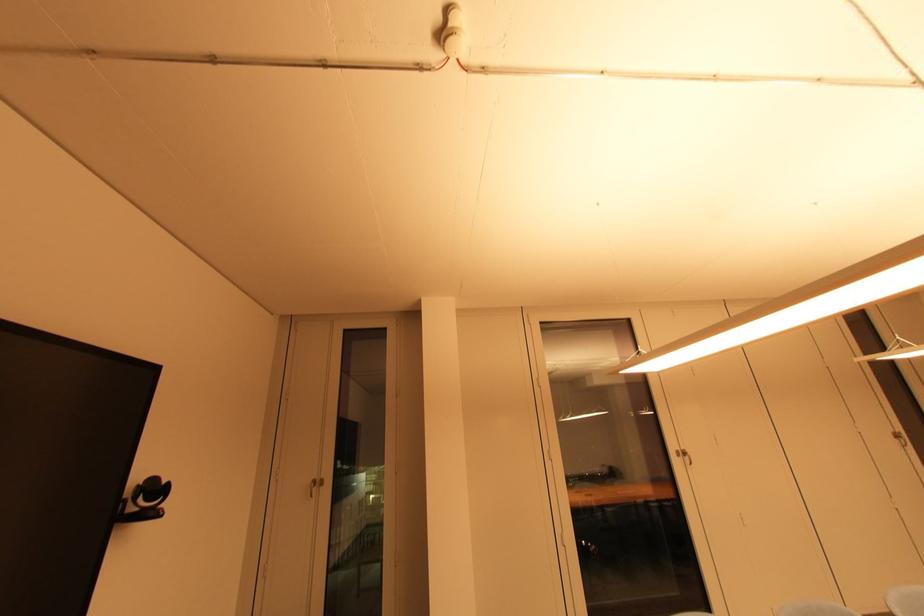
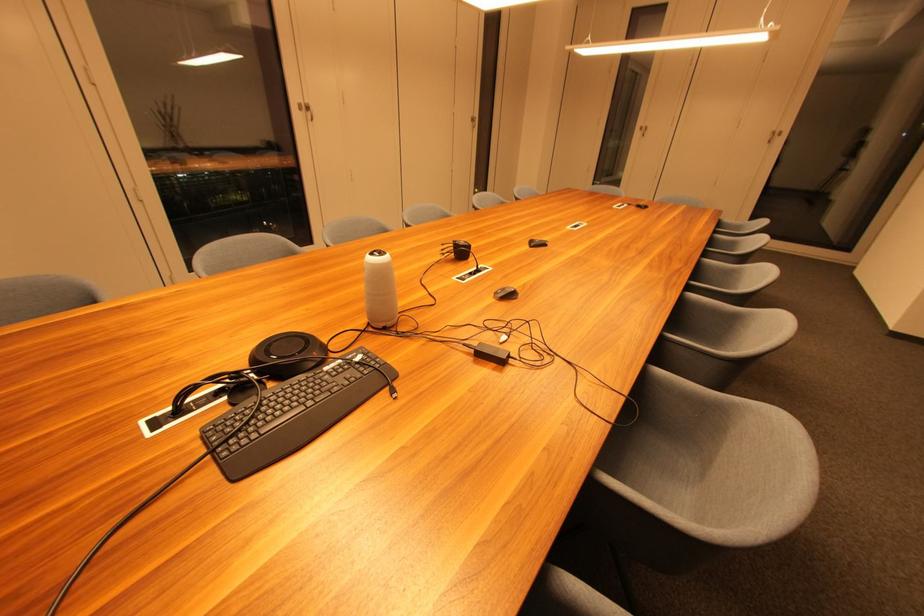
Locate, in the second image, the point that corresponds to (685,458) in the first image.

(306, 111)